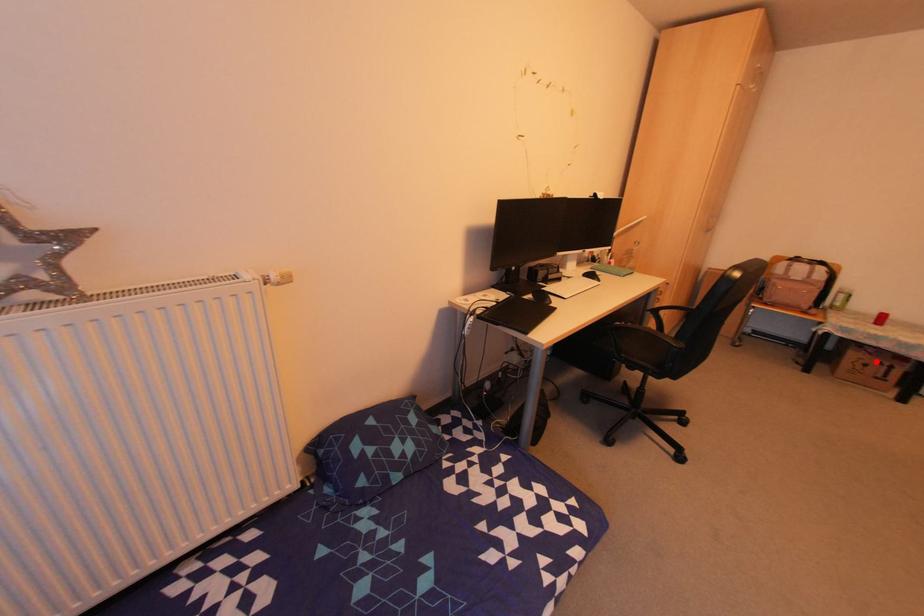
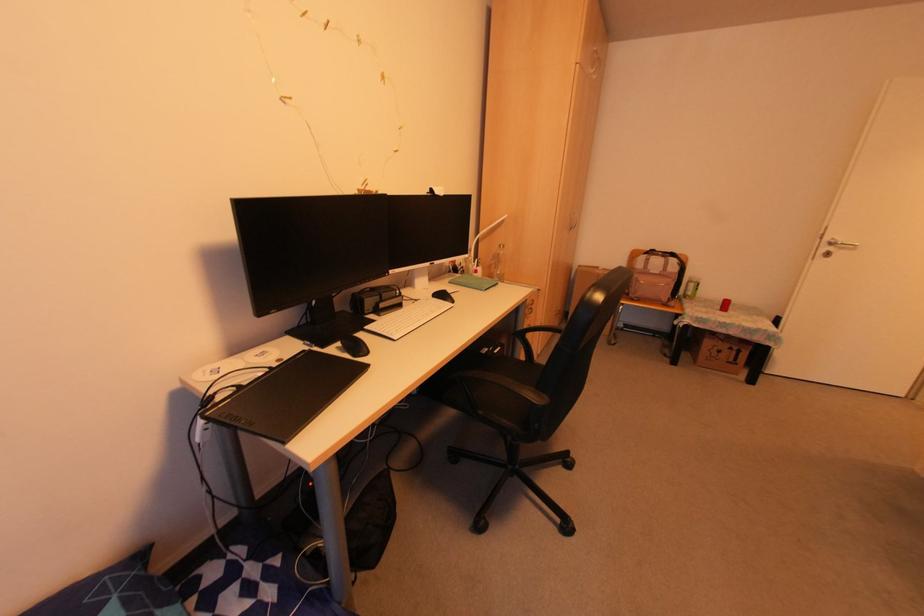
Find the pixel in the second image that matches the highlighted location in the first image.

(725, 346)